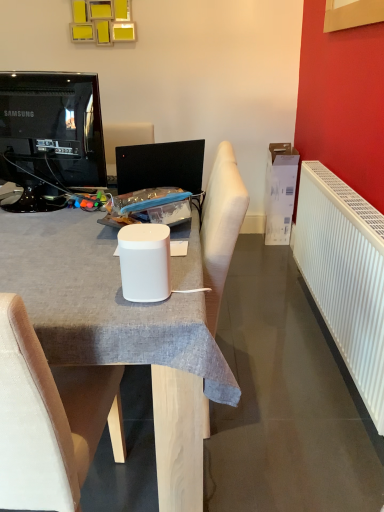
Question: Does point (76, 475) appear closer or farther from the camera than point (137, 251)?

Choices:
 (A) closer
 (B) farther

Answer: (B)

Question: Considering the positions of white fabric chair at center and white matte speaker at center in the image, is white fabric chair at center taller or shorter than white matte speaker at center?

Choices:
 (A) tall
 (B) short

Answer: (A)

Question: Which object is the closest to the white fabric chair at center?

Choices:
 (A) white matte speaker at center
 (B) white matte speaker at center
 (C) white plastic radiator at right
 (D) black glossy television at upper left

Answer: (B)

Question: Which of these objects is positioned closest to the black glossy television at upper left?

Choices:
 (A) white matte speaker at center
 (B) white fabric chair at center
 (C) white matte speaker at center
 (D) white plastic radiator at right

Answer: (A)